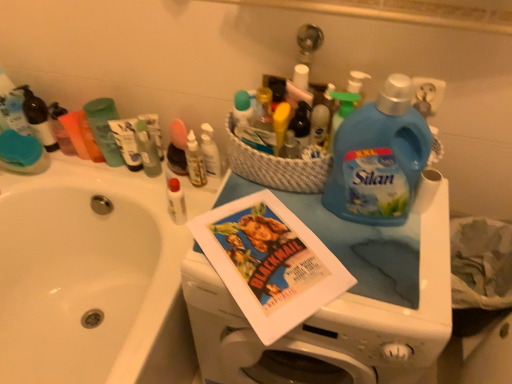
At what (x,y) coordinates should I click in order to perform the action: click on free space above blue plastic laundry detergent at upper right (from a real-world perspective). Please return your answer as a coordinate pair (x, y). The height and width of the screenshot is (384, 512). Looking at the image, I should click on (317, 244).